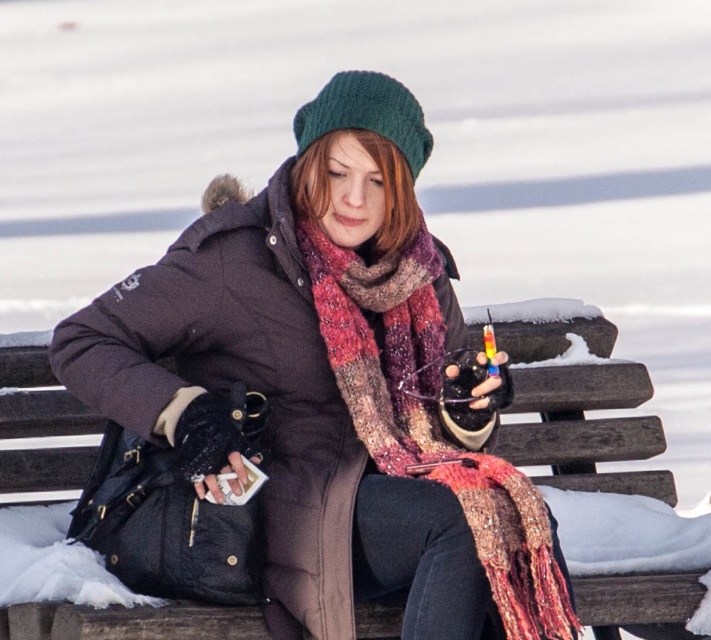
Between point (510, 500) and point (540, 557), which one is positioned in front?

Point (540, 557) is more forward.

Who is positioned more to the right, matte black coat at center or knitted wool scarf at center?

Positioned to the right is knitted wool scarf at center.

Which is in front, point (442, 264) or point (360, 403)?

Positioned in front is point (360, 403).

At what (x,y) coordinates should I click in order to perform the action: click on matte black coat at center. Please return your answer as a coordinate pair (x, y). Looking at the image, I should click on 320,401.

Does brown wooden bench at center have a greater width compared to knitted wool scarf at center?

Yes, brown wooden bench at center is wider than knitted wool scarf at center.

Is point (530, 353) farther from camera compared to point (347, 372)?

Yes, point (530, 353) is behind point (347, 372).

Is point (513, 371) in front of point (434, 449)?

No, it is not.

In order to click on brown wooden bench at center in this screenshot , I will do `click(598, 461)`.

Does matte black coat at center appear on the right side of brown wooden bench at center?

In fact, matte black coat at center is to the left of brown wooden bench at center.

Is point (169, 410) in front of point (77, 570)?

That is True.

Which is in front, point (73, 365) or point (700, 522)?

Point (73, 365) is more forward.

Where is `matte black coat at center`? The width and height of the screenshot is (711, 640). matte black coat at center is located at coordinates (320, 401).